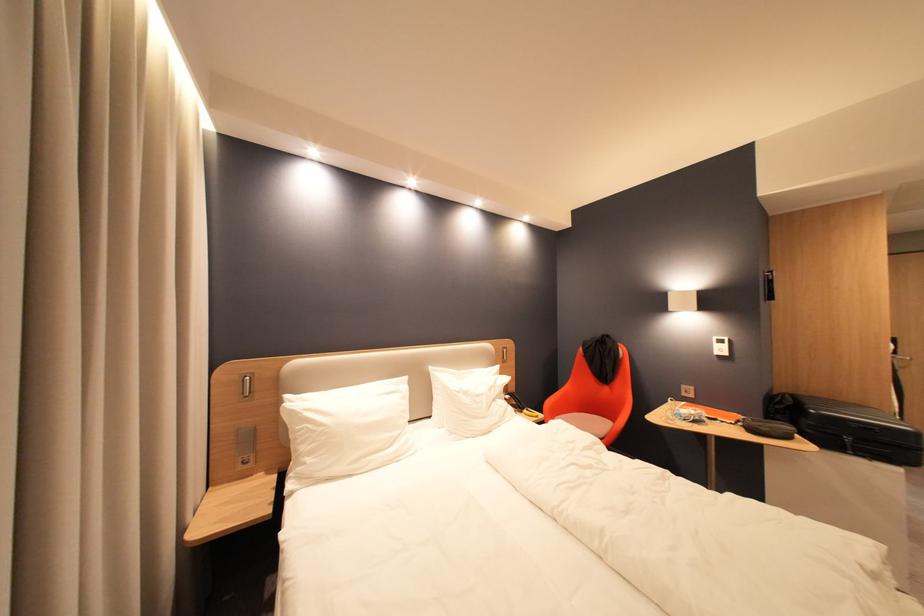
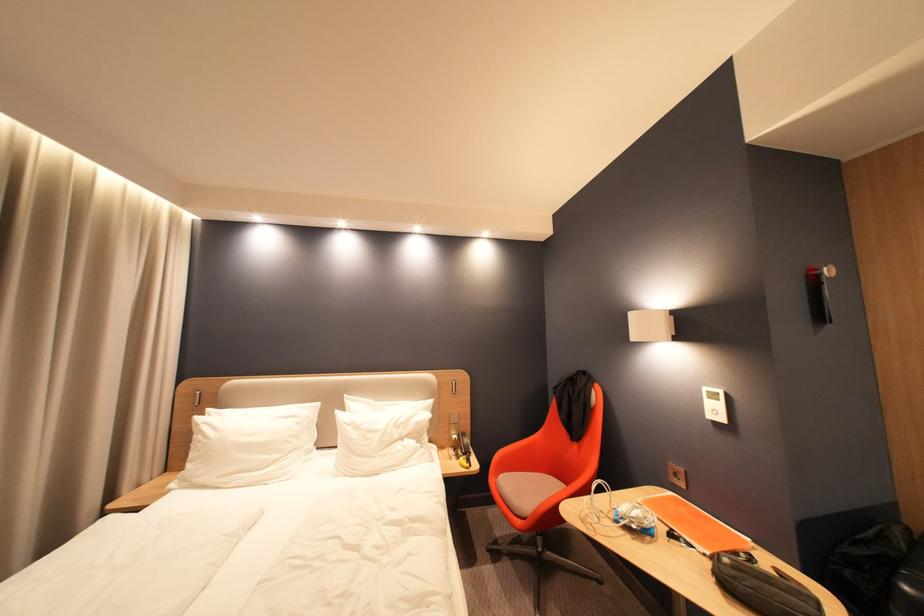
Locate, in the second image, the point that corresponds to (736,419) in the first image.

(710, 544)